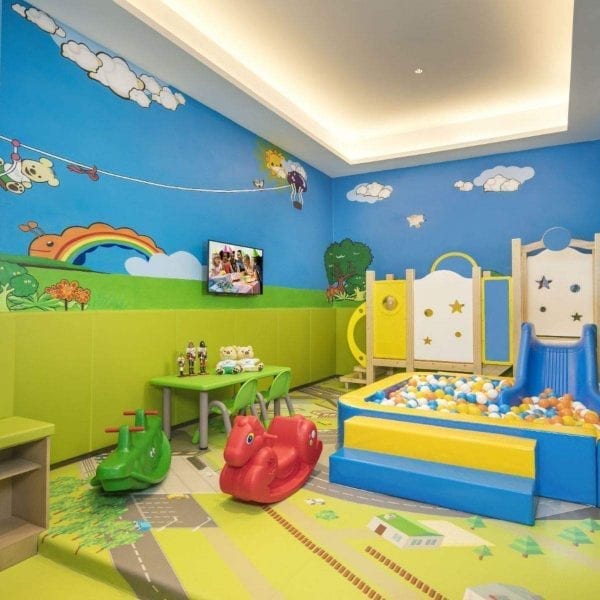
Locate an element on the screen. cushioned green wall is located at coordinates (88, 367).